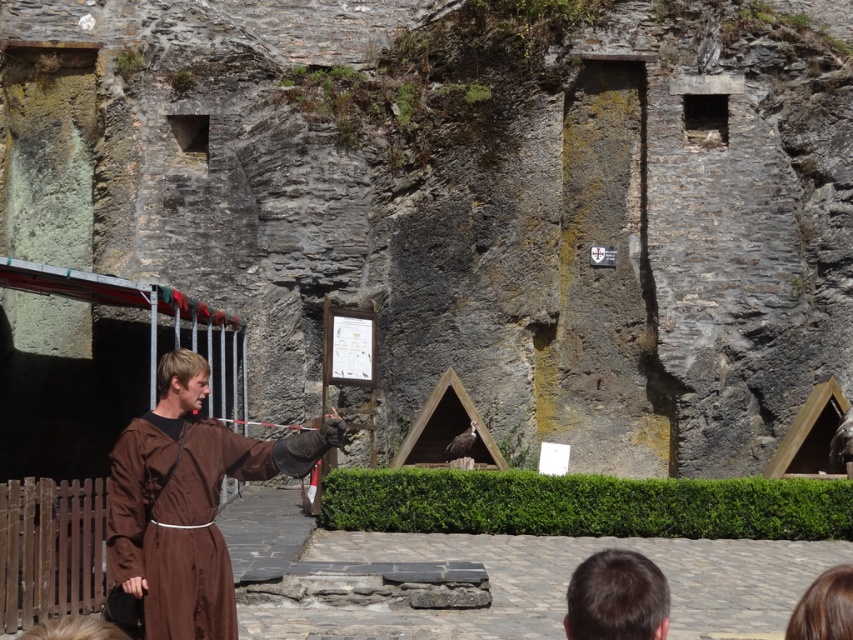
Question: Which of the following is the closest to the observer?

Choices:
 (A) (186, 355)
 (B) (567, 604)

Answer: (A)

Question: Is brown clothed man at center above brown hair at lower center?

Choices:
 (A) yes
 (B) no

Answer: (A)

Question: Which object is farther from the camera taking this photo?

Choices:
 (A) brown clothed man at center
 (B) brown hair at lower center

Answer: (A)

Question: Where is brown clothed man at center located in relation to brown hair at lower center in the image?

Choices:
 (A) left
 (B) right

Answer: (A)

Question: Can you confirm if brown clothed man at center is positioned below brown hair at lower center?

Choices:
 (A) yes
 (B) no

Answer: (B)